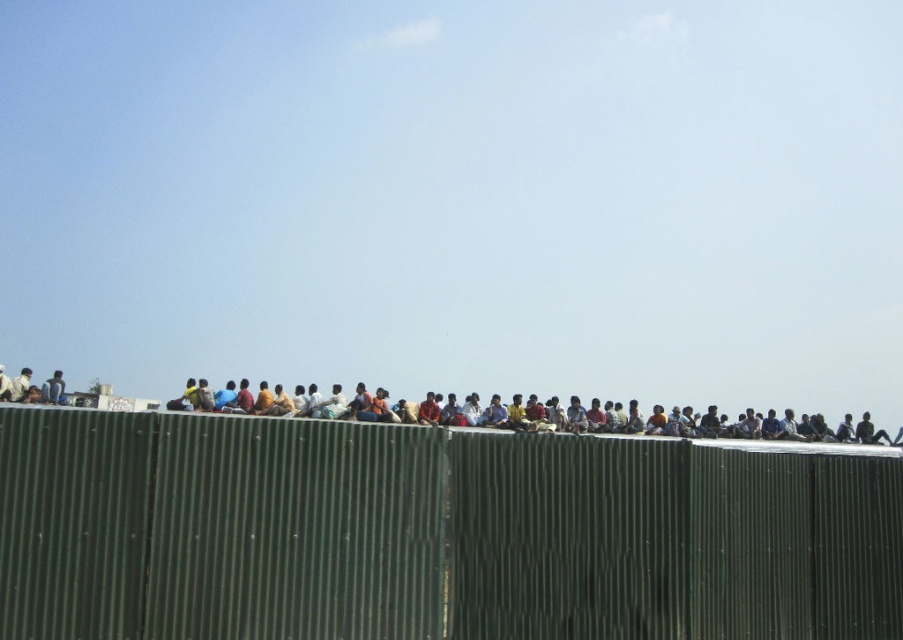
You are standing at the origin point of the coordinate system in the image. You need to move towards the green corrugated metal fence at center. What direction should you move in to reach it?

The green corrugated metal fence at center is located at point (431, 532), so you should move towards the right and slightly forward to reach it.

You are a photographer trying to capture a photo of the green corrugated metal fence at center and the dark blue jeans at center. From the perspective of someone standing in front of the fence, which object is located to your right?

The green corrugated metal fence at center is positioned on the right side of dark blue jeans at center, so from the photographer standing in front of the fence, the fence would be to their right relative to the dark blue jeans at center.

You are standing at the point labeled as point (431,532) and want to move towards the nearest edge of the green corrugated metal fence at center. Which direction should you go?

The point (431,532) is on the green corrugated metal fence at center, so you are already on the fence. To reach the nearest edge, you should move either left or right along the fence until you reach its end.